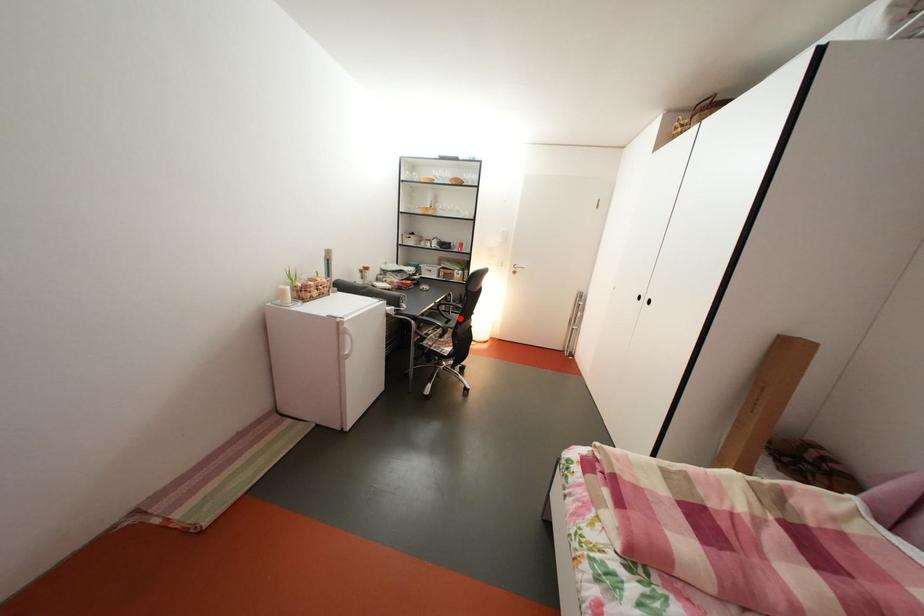
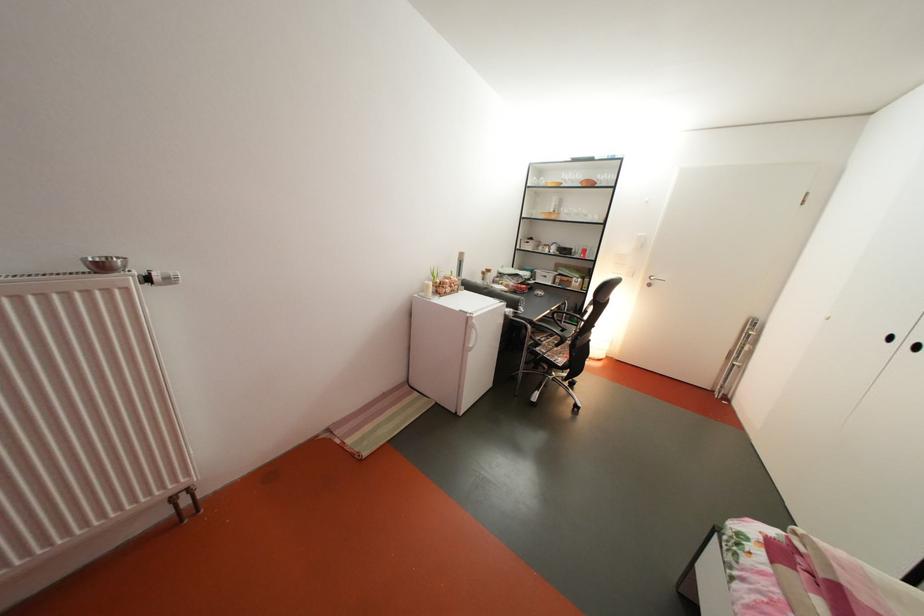
The point at the highlighted location is marked in the first image. Where is the corresponding point in the second image?

(573, 328)